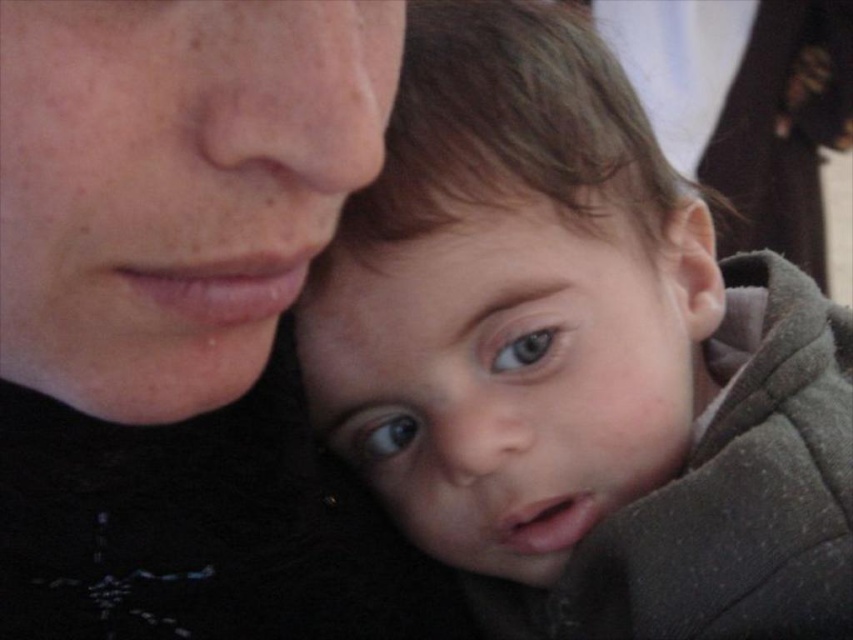
Which is in front, point (225, 529) or point (543, 348)?

Point (543, 348) is more forward.

Is point (129, 416) less distant than point (543, 356)?

Yes.

Locate an element on the screen. This screenshot has width=853, height=640. matte black face at upper left is located at coordinates (175, 314).

Can you confirm if smooth brown hair at center is shorter than brown glossy eye at center?

No, smooth brown hair at center is not shorter than brown glossy eye at center.

Locate an element on the screen. The width and height of the screenshot is (853, 640). smooth brown hair at center is located at coordinates (579, 355).

Which is in front, point (798, 483) or point (219, 28)?

Point (219, 28) is more forward.

Is smooth brown hair at center to the right of matte black face at upper left from the viewer's perspective?

Yes, smooth brown hair at center is to the right of matte black face at upper left.

Where is `smooth brown hair at center`? smooth brown hair at center is located at coordinates 579,355.

Where is `smooth brown hair at center`? The image size is (853, 640). smooth brown hair at center is located at coordinates [x=579, y=355].